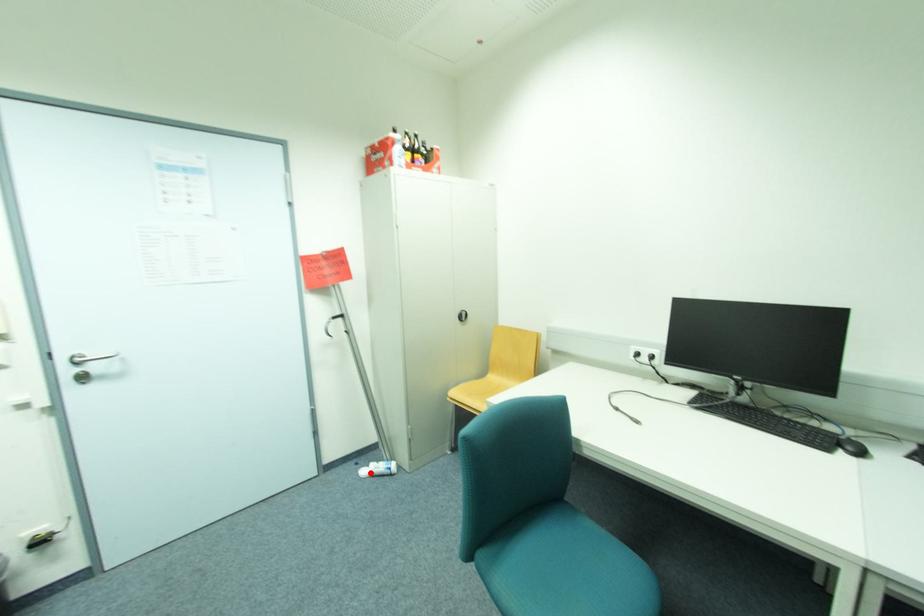
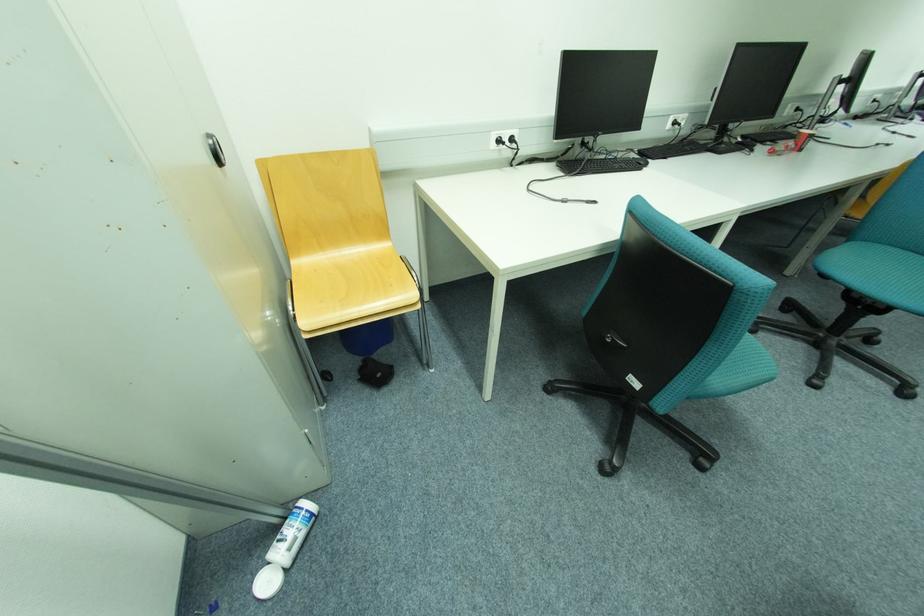
The point at the highlighted location is marked in the first image. Where is the corresponding point in the second image?

(274, 584)